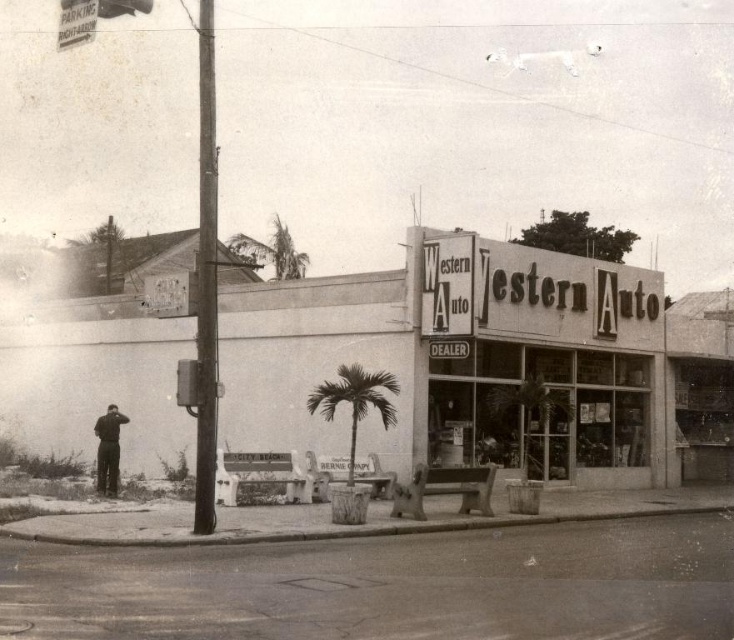
Is the position of white concrete western auto at center less distant than that of green leafy palm tree at upper center?

→ Yes, white concrete western auto at center is closer to the viewer.

Can you confirm if white concrete western auto at center is smaller than green leafy palm tree at upper center?

Yes.

Is point (611, 465) closer to camera compared to point (265, 257)?

That is True.

Locate an element on the screen. The height and width of the screenshot is (640, 734). white concrete western auto at center is located at coordinates (534, 352).

Which is behind, point (377, 384) or point (103, 428)?

Point (103, 428)

Is green leafy palm tree at center shorter than dark gray suit at left?

Yes, green leafy palm tree at center is shorter than dark gray suit at left.

Where is `green leafy palm tree at center`? green leafy palm tree at center is located at coordinates point(355,401).

Is green leafy palm tree at upper center above dark gray suit at left?

Indeed, green leafy palm tree at upper center is positioned over dark gray suit at left.

Which is in front, point (280, 268) or point (112, 468)?

Point (112, 468)

At what (x,y) coordinates should I click in order to perform the action: click on green leafy palm tree at upper center. Please return your answer as a coordinate pair (x, y). The height and width of the screenshot is (640, 734). Looking at the image, I should click on (272, 252).